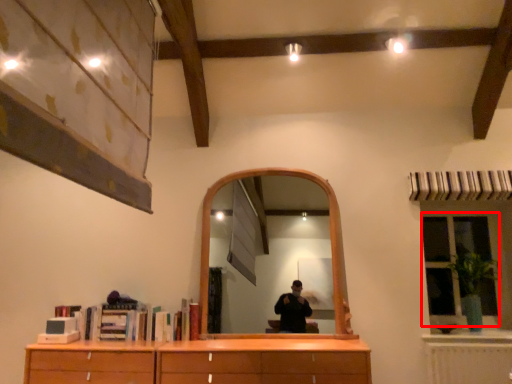
Question: Considering the relative positions of window (annotated by the red box) and plant in the image provided, where is window (annotated by the red box) located with respect to the staircase?

Choices:
 (A) right
 (B) left

Answer: (A)